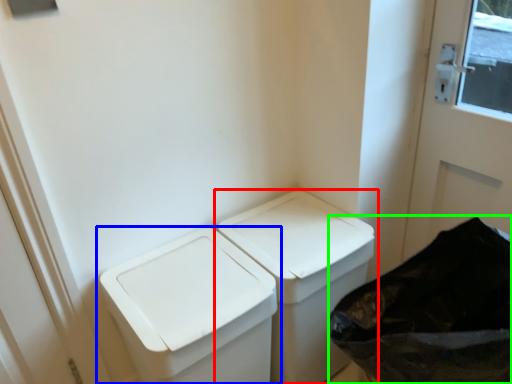
Question: Based on their relative distances, which object is farther from waste container (highlighted by a red box)? Choose from waste container (highlighted by a blue box) and recycling bin (highlighted by a green box).

Choices:
 (A) waste container
 (B) recycling bin

Answer: (B)